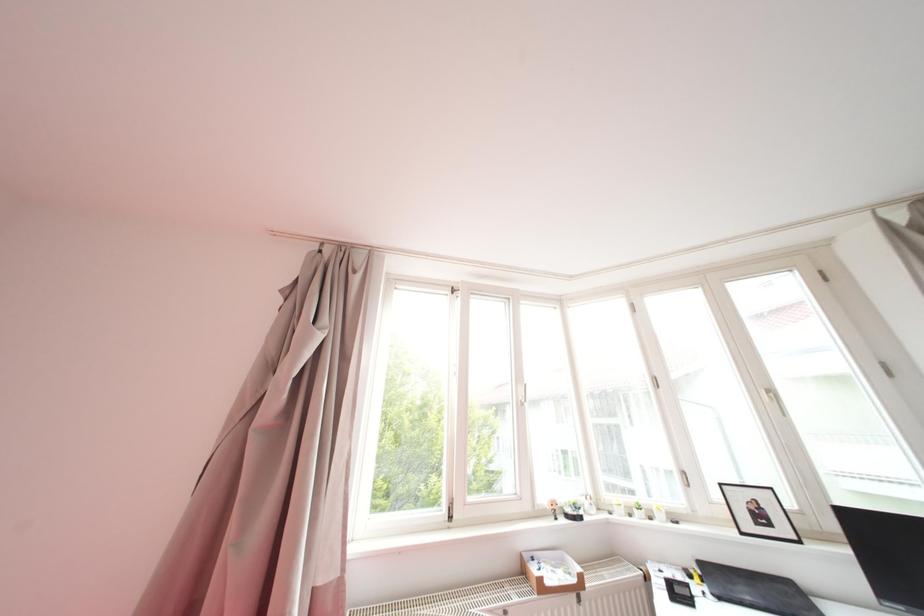
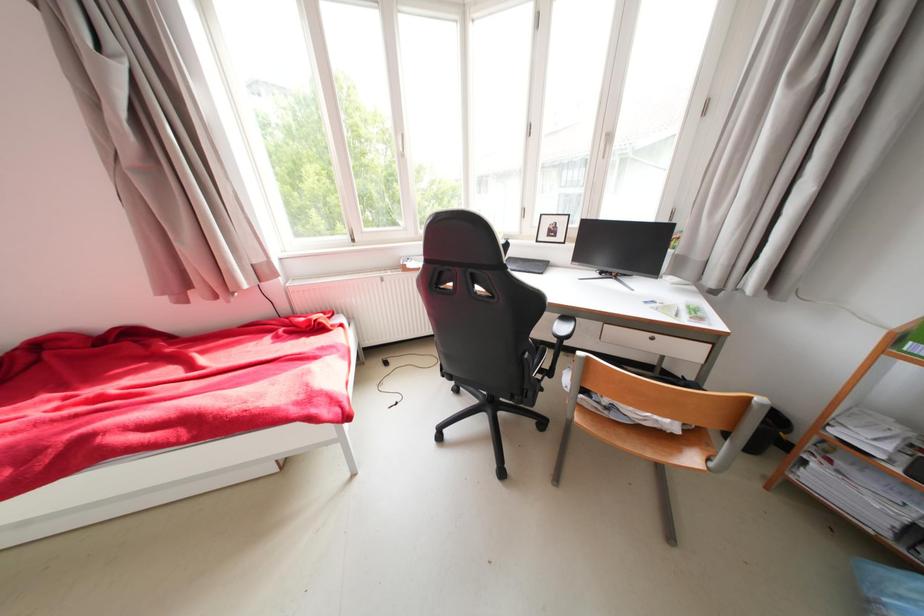
Question: Based on the continuous images, in which direction is the camera rotating? Reply with the corresponding letter.

Choices:
 (A) Left
 (B) Right
 (C) Up
 (D) Down

Answer: (D)